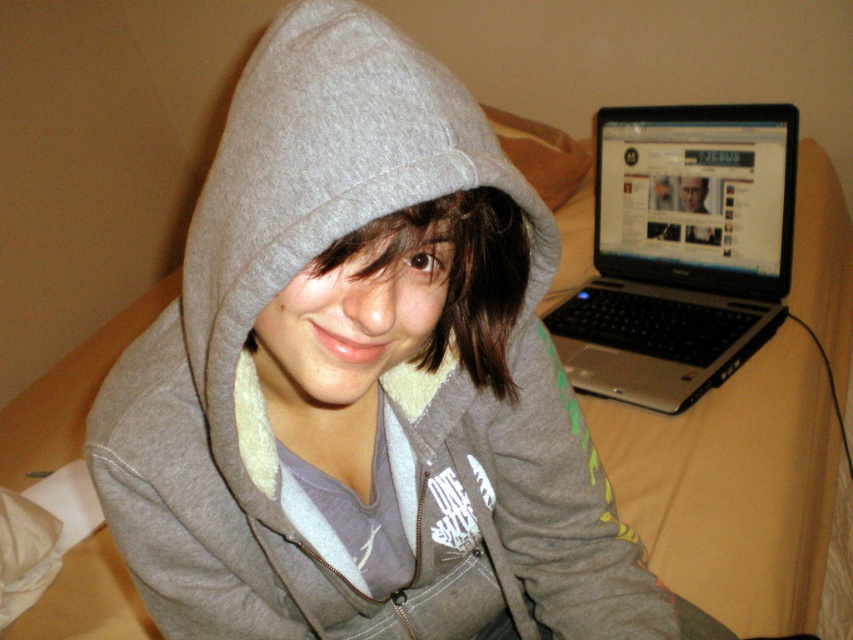
Question: Which object appears closest to the camera in this image?

Choices:
 (A) silver/black laptop at upper right
 (B) gray fleece hoodie at center

Answer: (B)

Question: Which of the following is the closest to the observer?

Choices:
 (A) [x=648, y=125]
 (B) [x=190, y=364]

Answer: (B)

Question: Can you confirm if gray fleece hoodie at center is positioned to the left of silver/black laptop at upper right?

Choices:
 (A) yes
 (B) no

Answer: (A)

Question: Where is gray fleece hoodie at center located in relation to silver/black laptop at upper right in the image?

Choices:
 (A) left
 (B) right

Answer: (A)

Question: Does gray fleece hoodie at center have a greater width compared to silver/black laptop at upper right?

Choices:
 (A) yes
 (B) no

Answer: (B)